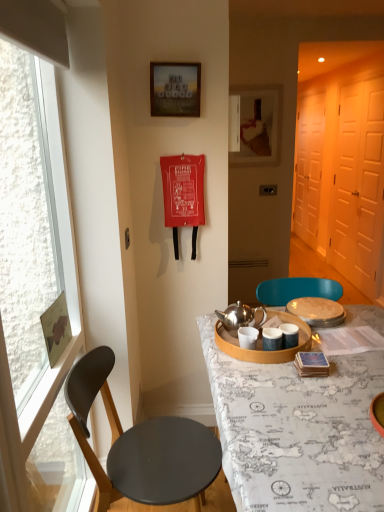
This screenshot has height=512, width=384. I want to click on vacant space underneath matte silver tray at center, which ranks as the 1th tableware in right-to-left order (from a real-world perspective), so tap(317, 315).